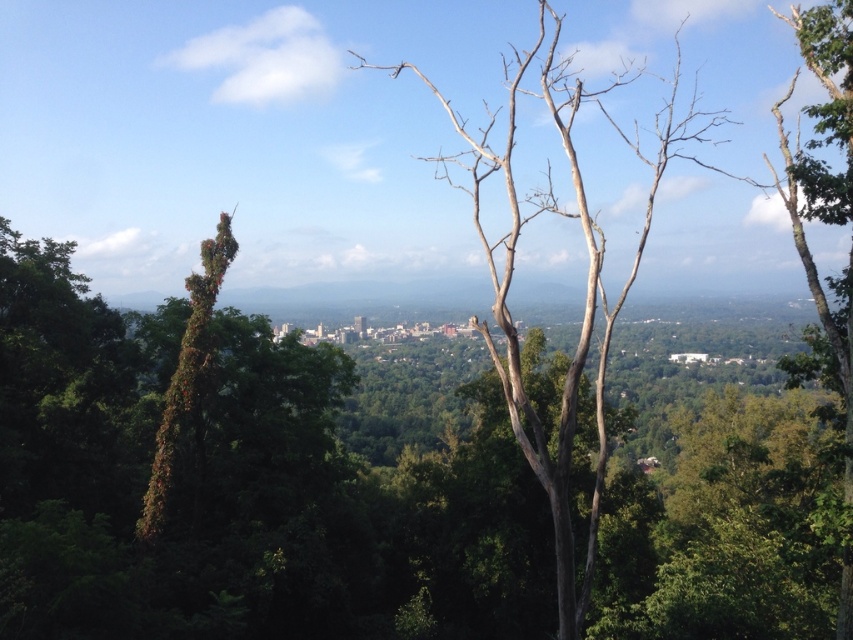
Question: Can you confirm if green leafy tree at center is smaller than bare wood tree at center?

Choices:
 (A) no
 (B) yes

Answer: (B)

Question: Is green leafy tree at center thinner than bare wood tree at center?

Choices:
 (A) no
 (B) yes

Answer: (B)

Question: Which point is farther to the camera?

Choices:
 (A) (140, 616)
 (B) (508, 380)

Answer: (A)

Question: Can you confirm if green leafy tree at center is smaller than bare wood tree at center?

Choices:
 (A) no
 (B) yes

Answer: (B)

Question: Which of the following is the farthest from the observer?

Choices:
 (A) (526, 426)
 (B) (33, 528)

Answer: (A)